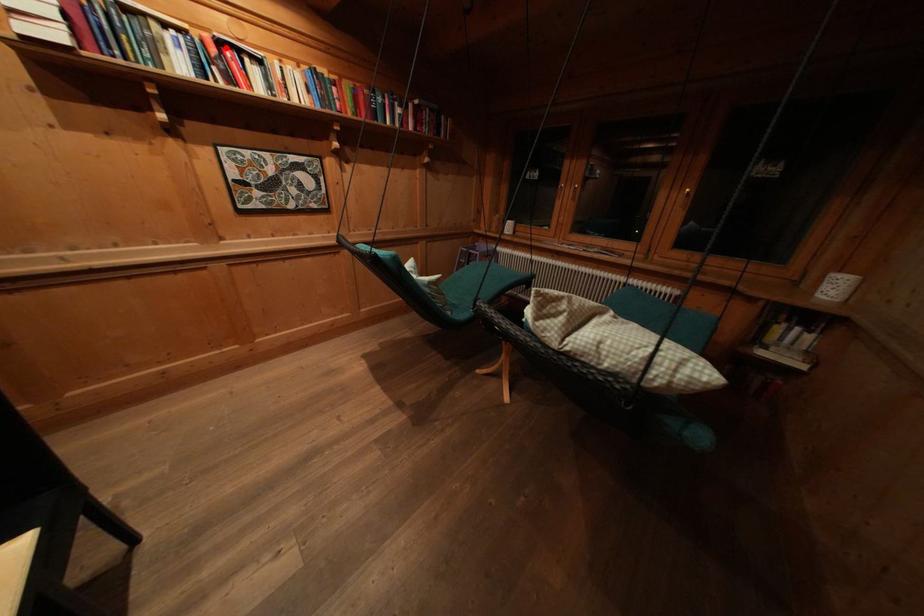
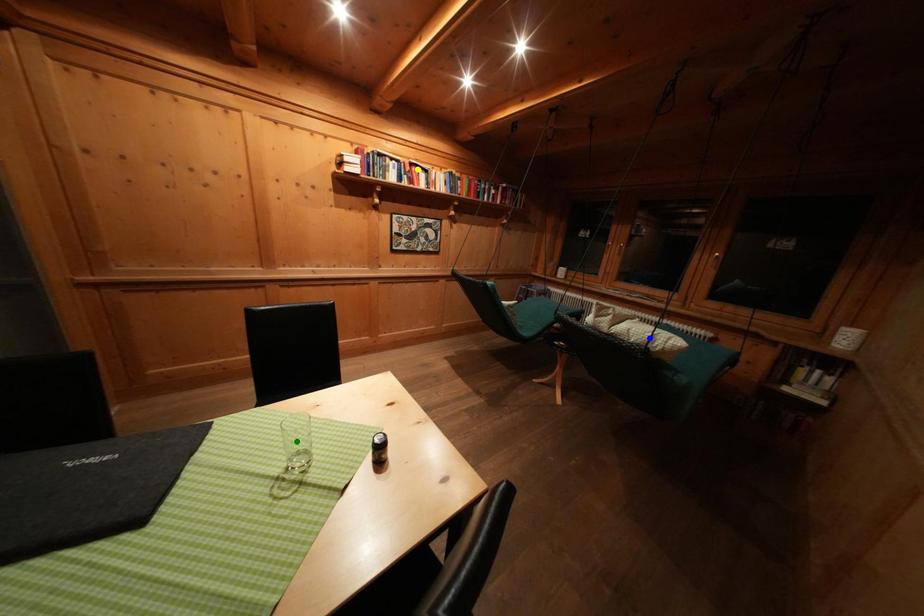
Question: I am providing you with two images of the same scene from different viewpoints. A red point is marked on the first image. You are given multiple points on the second image. Which point in image 2 represents the same 3d spot as the red point in image 1?

Choices:
 (A) green point
 (B) blue point
 (C) yellow point

Answer: (C)